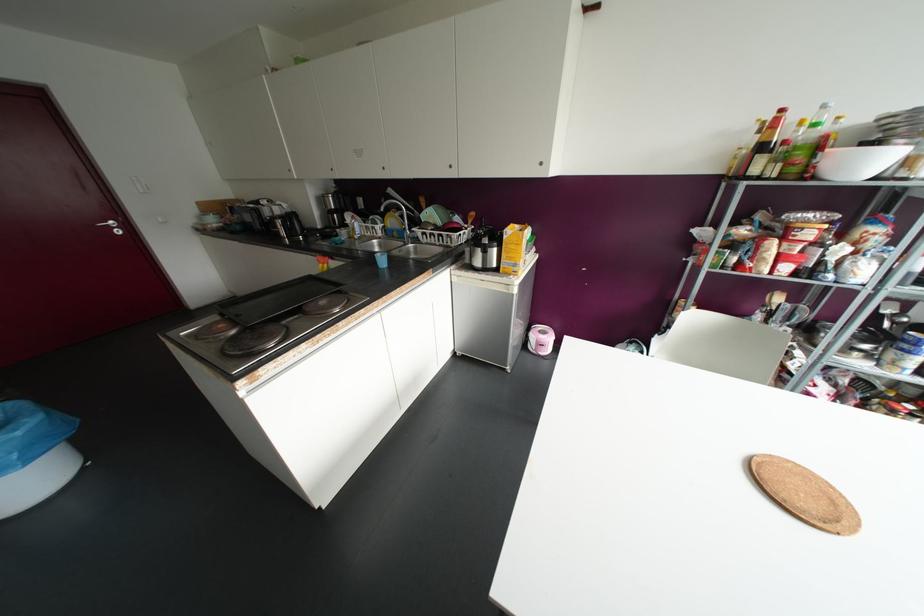
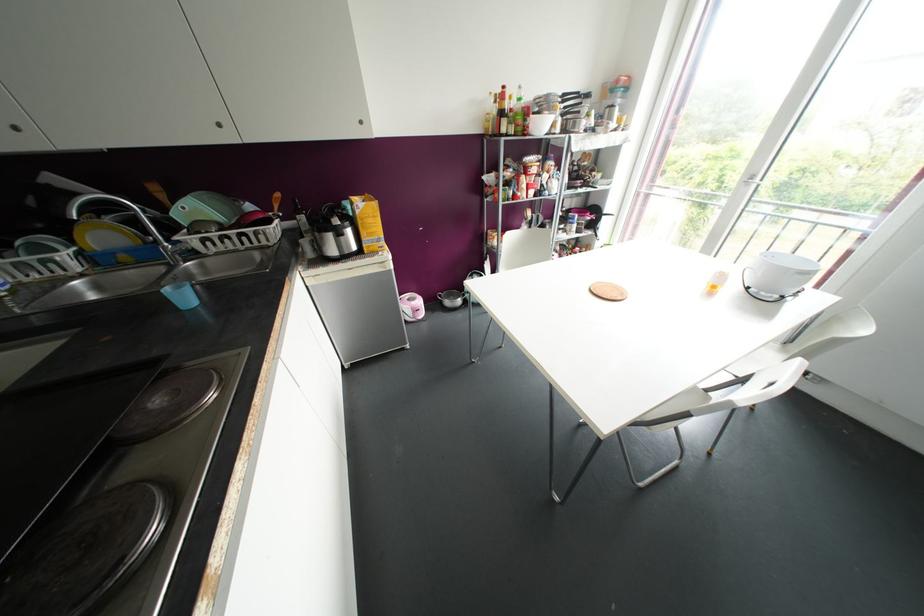
Find the pixel in the second image that matches (x=382, y=261) in the first image.

(184, 297)